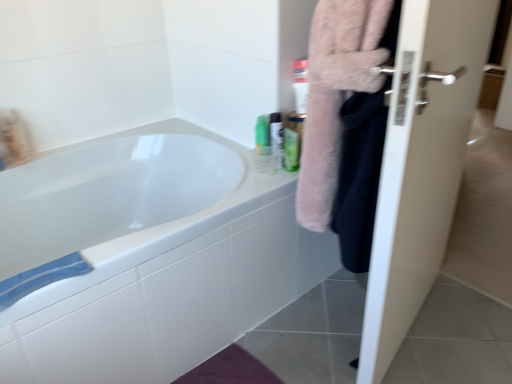
The image size is (512, 384). In order to click on vacant region to the left of white glossy mouthwash at upper right, acting as the 2th mouthwash starting from the right in this screenshot , I will do `click(253, 160)`.